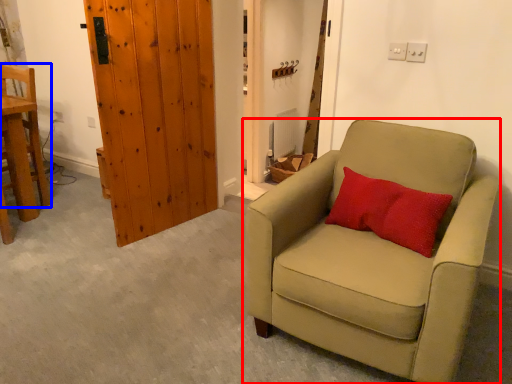
Question: Which point is closer to the camera, chair (highlighted by a red box) or chair (highlighted by a blue box)?

Choices:
 (A) chair
 (B) chair

Answer: (A)